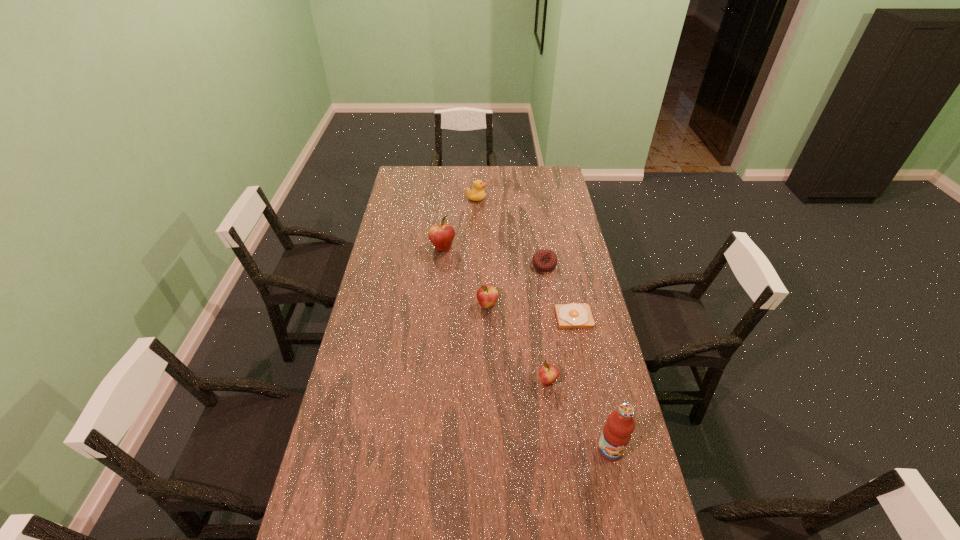
Where is `the sixth tallest object`? Image resolution: width=960 pixels, height=540 pixels. the sixth tallest object is located at coordinates (544, 260).

At what (x,y) coordinates should I click in order to perform the action: click on free space located on the front of the leftmost object. Please return your answer as a coordinate pair (x, y). Looking at the image, I should click on (438, 296).

Image resolution: width=960 pixels, height=540 pixels. Identify the location of vacant area situated on the back of the second shortest apple. (487, 249).

This screenshot has height=540, width=960. What are the coordinates of `vacant space situated 0.350m on the left of the rightmost apple` in the screenshot? It's located at click(x=433, y=382).

Identify the location of free space located 0.310m at the beak of the farthest object. (545, 198).

What are the coordinates of `free space located on the front of the toast` in the screenshot? It's located at point(594,416).

Where is `vacant space situated on the front label of the nearest object`? The height and width of the screenshot is (540, 960). vacant space situated on the front label of the nearest object is located at coordinates (628, 530).

You are a GUI agent. You are given a task and a screenshot of the screen. Output one action in this format:
    pyautogui.click(x=<x>, y=<y>)
    Task: Click on the free space located 0.150m on the back of the sixth tallest object
    The image size is (960, 540).
    Given the screenshot: What is the action you would take?
    pyautogui.click(x=540, y=236)

Where is `toast that is at the right edge`? toast that is at the right edge is located at coordinates (573, 315).

Identify the location of fruit juice located at the right edge. The height and width of the screenshot is (540, 960). (617, 432).